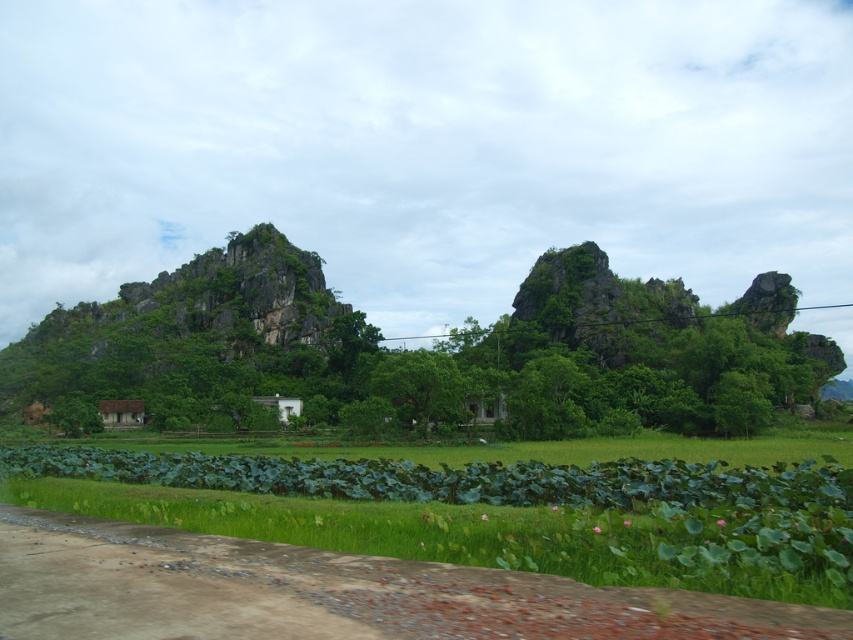
Question: Which point is closer to the camera?

Choices:
 (A) click(506, 556)
 (B) click(132, 412)

Answer: (A)

Question: Which of the following is the farthest from the observer?

Choices:
 (A) rocky gray mountain at left
 (B) green grassy field at lower center

Answer: (A)

Question: Does green grassy field at lower center appear under rocky gray mountain at left?

Choices:
 (A) yes
 (B) no

Answer: (A)

Question: Where is green grassy field at lower center located in relation to rocky gray mountain at left in the image?

Choices:
 (A) below
 (B) above

Answer: (A)

Question: Among these points, which one is nearest to the camera?

Choices:
 (A) (715, 573)
 (B) (361, 388)

Answer: (A)

Question: Is green grassy field at lower center thinner than rocky gray mountain at left?

Choices:
 (A) yes
 (B) no

Answer: (A)